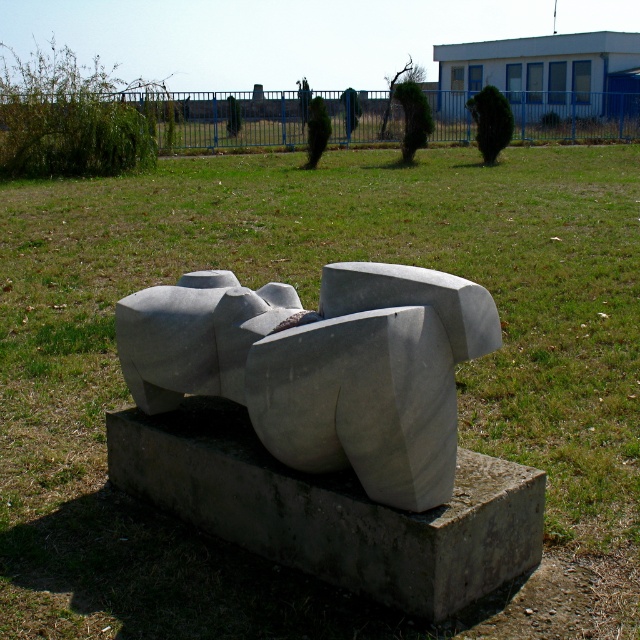
Is gray stone sculpture at center taller than gray concrete sculpture at center?

Correct, gray stone sculpture at center is much taller as gray concrete sculpture at center.

Does gray stone sculpture at center come behind gray concrete sculpture at center?

No, gray stone sculpture at center is in front of gray concrete sculpture at center.

Who is more distant from viewer, (422,276) or (365,580)?

The point (365,580) is behind.

Find the location of a particular element. The height and width of the screenshot is (640, 640). gray stone sculpture at center is located at coordinates (321, 365).